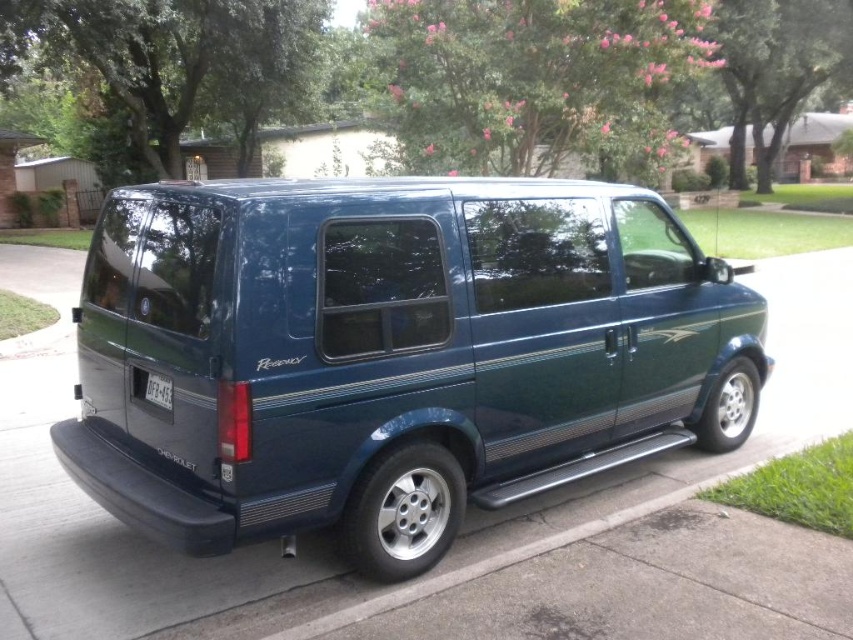
Between point (482, 296) and point (170, 381), which one is positioned in front?

Point (170, 381) is in front.

Is metallic blue van at center above white plastic license plate at lower center?

Correct, metallic blue van at center is located above white plastic license plate at lower center.

Is point (316, 449) closer to viewer compared to point (163, 396)?

Yes, point (316, 449) is closer to viewer.

At what (x,y) coordinates should I click in order to perform the action: click on metallic blue van at center. Please return your answer as a coordinate pair (x, y). Image resolution: width=853 pixels, height=640 pixels. Looking at the image, I should click on (392, 353).